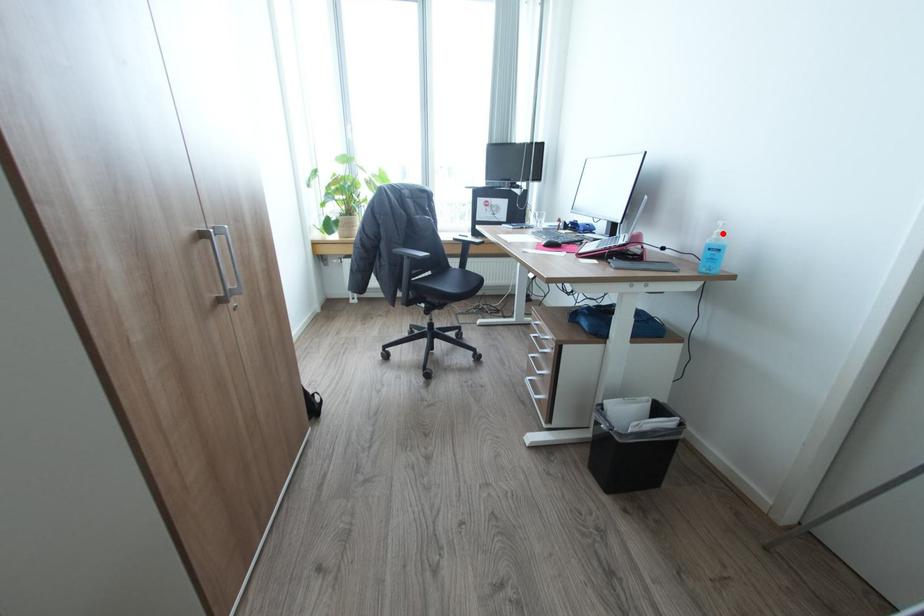
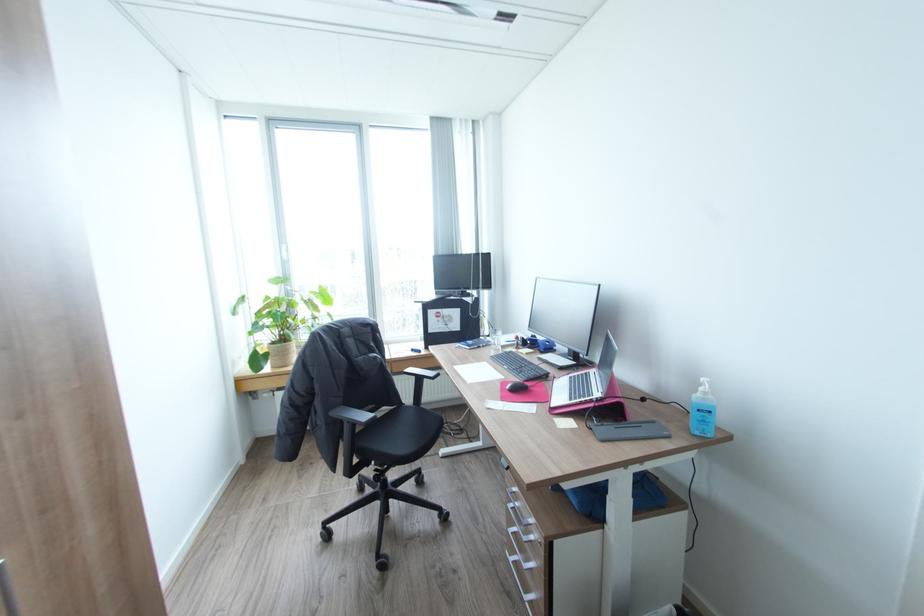
In the second image, find the point that corresponds to the highlighted location in the first image.

(710, 392)